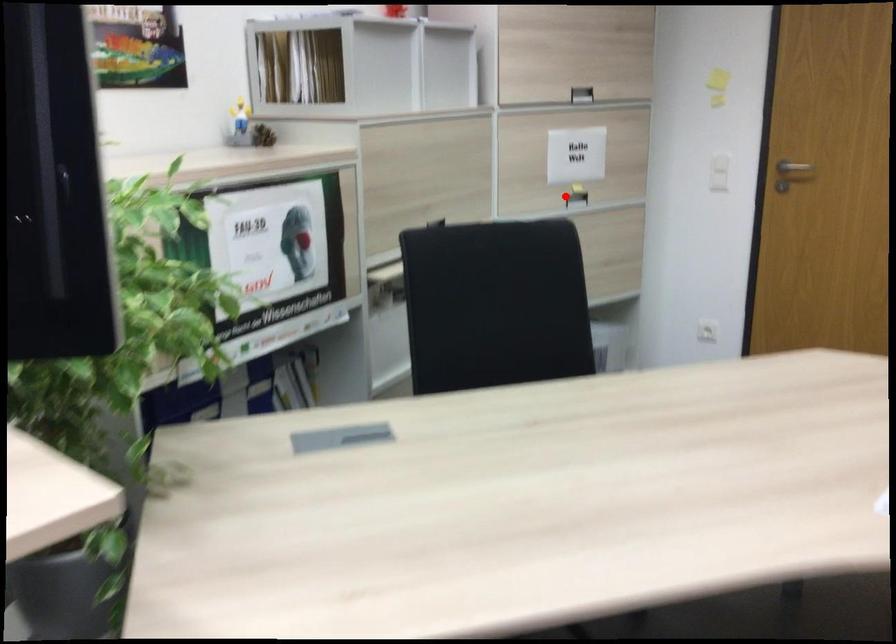
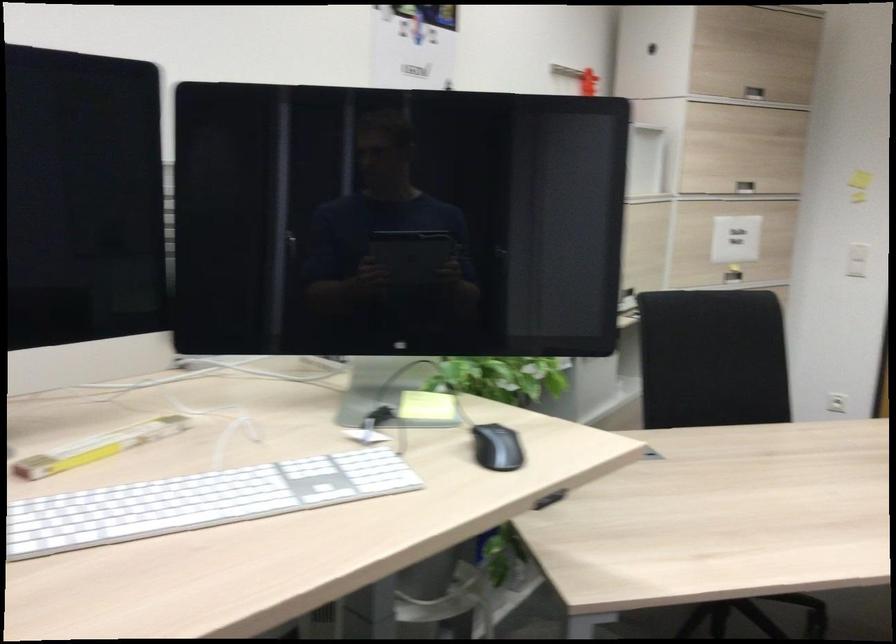
The point at the highlighted location is marked in the first image. Where is the corresponding point in the second image?

(733, 275)